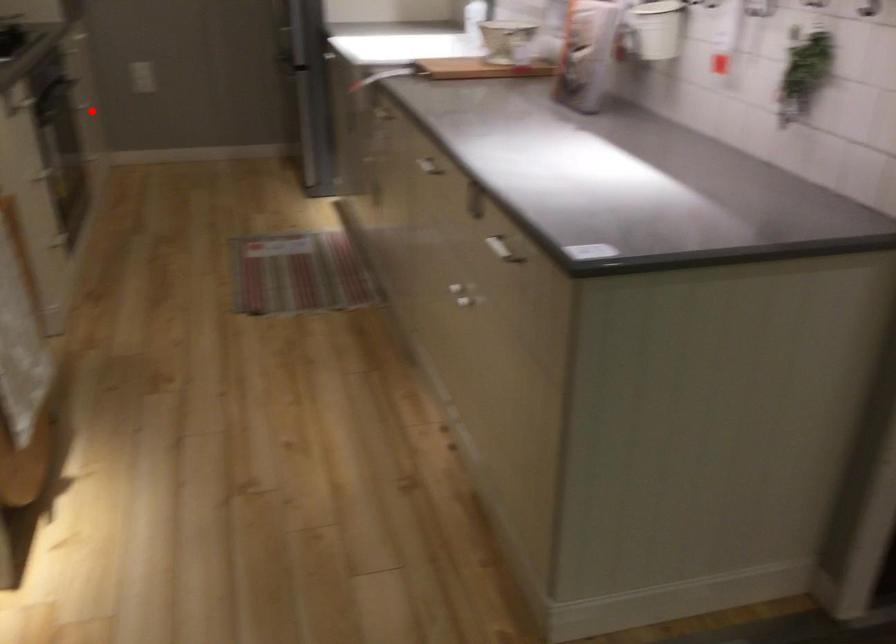
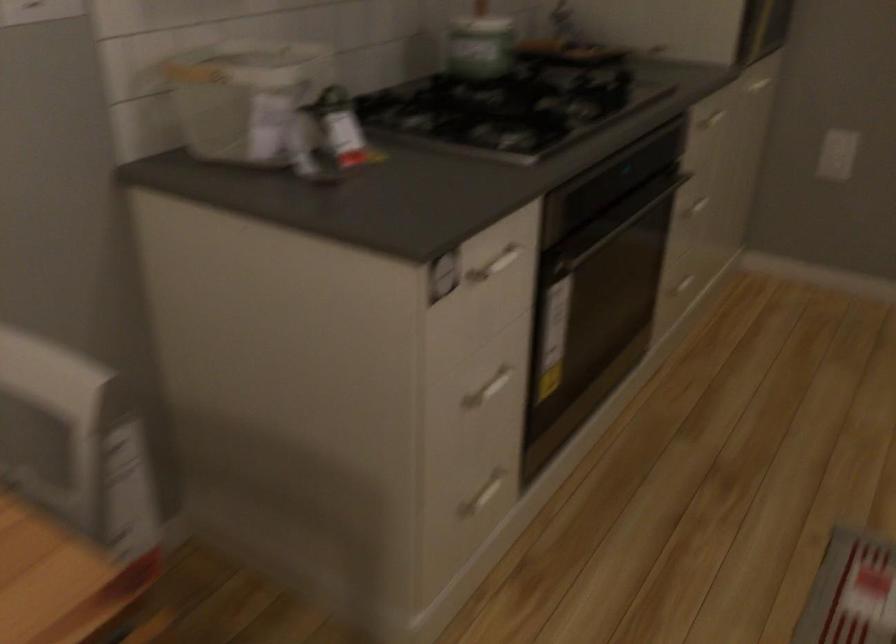
Question: I am providing you with two images of the same scene from different viewpoints. Given a red point in image1, look at the same physical point in image2. Is it:

Choices:
 (A) Closer to the viewpoint
 (B) Farther from the viewpoint

Answer: (A)